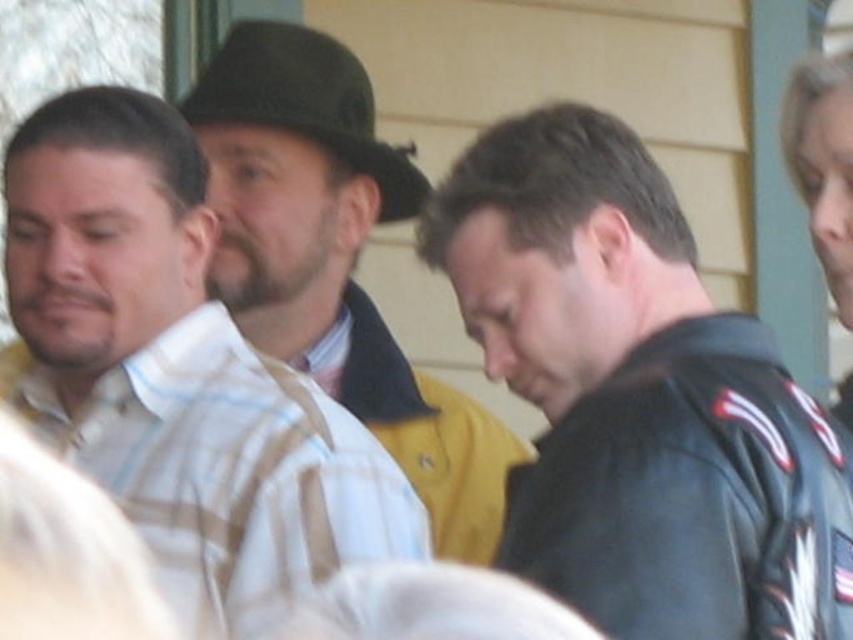
You are organizing a clothing sale and need to categorize items by size. You have two items to sort out of frame, a striped cotton shirt at left and a matte brown hat at center. Which item requires a larger display space?

The striped cotton shirt at left requires a larger display space because it is bigger than the matte brown hat at center.

Based on the coordinates provided, which object in the scene is located at point (178, 371)?

The point (178, 371) is located on the striped cotton shirt at left.

You are trying to decide whether to wear the black leather jacket at center or the black felt fedora at center for an event. Based on their sizes, which one might be more suitable for layering over a thick sweater?

The black leather jacket at center is wider than the black felt fedora at center, so the jacket would be more suitable for layering over a thick sweater as it can accommodate more bulk.